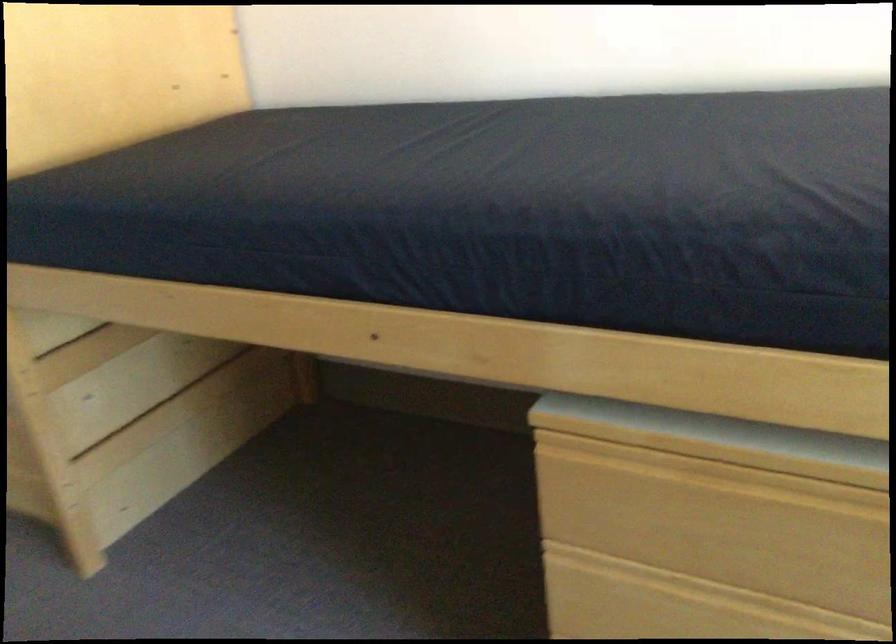
Question: Based on the continuous images, in which direction is the camera rotating? Reply with the corresponding letter.

Choices:
 (A) Left
 (B) Right
 (C) Up
 (D) Down

Answer: (B)